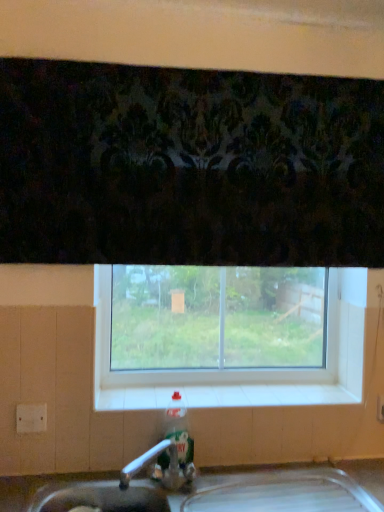
Question: From the image's perspective, is white tile at center below clear glass window at center?

Choices:
 (A) yes
 (B) no

Answer: (A)

Question: Considering the relative positions of white tile at center and clear glass window at center in the image provided, is white tile at center behind clear glass window at center?

Choices:
 (A) no
 (B) yes

Answer: (A)

Question: Are white tile at center and clear glass window at center beside each other?

Choices:
 (A) no
 (B) yes

Answer: (A)

Question: Does white tile at center have a lesser width compared to clear glass window at center?

Choices:
 (A) yes
 (B) no

Answer: (B)

Question: Is clear glass window at center at the back of white tile at center?

Choices:
 (A) no
 (B) yes

Answer: (B)

Question: Does point (296, 402) appear closer or farther from the camera than point (183, 416)?

Choices:
 (A) farther
 (B) closer

Answer: (A)

Question: From a real-world perspective, is white tile at center positioned above or below translucent plastic bottle at sink?

Choices:
 (A) above
 (B) below

Answer: (A)

Question: Considering the positions of white tile at center and translucent plastic bottle at sink in the image, is white tile at center bigger or smaller than translucent plastic bottle at sink?

Choices:
 (A) big
 (B) small

Answer: (A)

Question: Visually, is white tile at center positioned to the left or to the right of translucent plastic bottle at sink?

Choices:
 (A) right
 (B) left

Answer: (A)

Question: Considering the positions of translucent plastic bottle at sink and clear glass window at center in the image, is translucent plastic bottle at sink taller or shorter than clear glass window at center?

Choices:
 (A) tall
 (B) short

Answer: (B)

Question: Is translucent plastic bottle at sink to the left or to the right of clear glass window at center in the image?

Choices:
 (A) right
 (B) left

Answer: (B)

Question: In the image, is translucent plastic bottle at sink positioned in front of or behind clear glass window at center?

Choices:
 (A) front
 (B) behind

Answer: (A)

Question: In terms of width, does translucent plastic bottle at sink look wider or thinner when compared to clear glass window at center?

Choices:
 (A) wide
 (B) thin

Answer: (A)

Question: Relative to white tile at center, is clear glass window at center in front or behind?

Choices:
 (A) front
 (B) behind

Answer: (B)

Question: Is clear glass window at center bigger or smaller than white tile at center?

Choices:
 (A) small
 (B) big

Answer: (B)